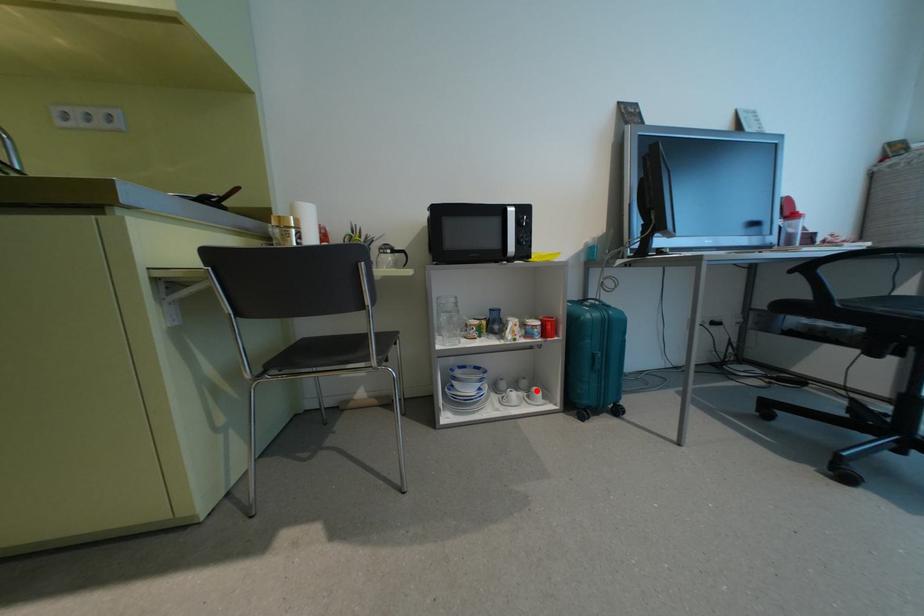
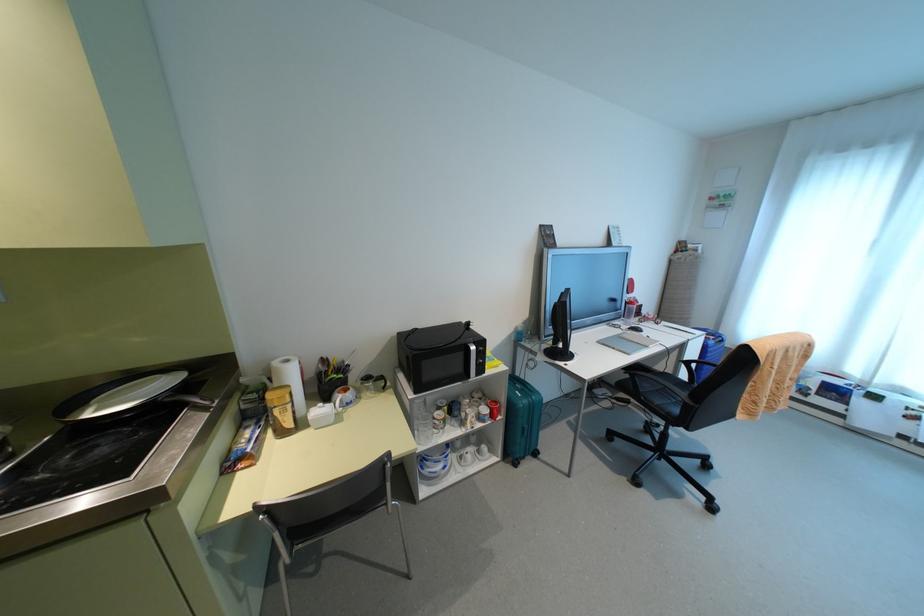
The point at the highlighted location is marked in the first image. Where is the corresponding point in the second image?

(483, 447)